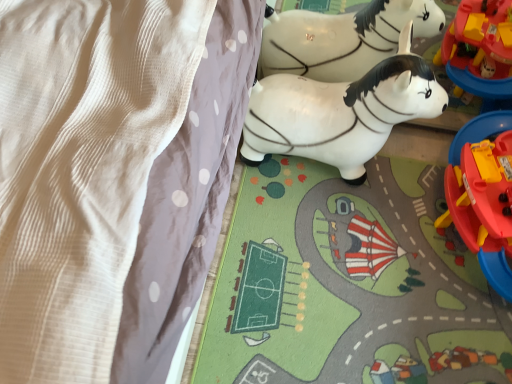
Question: Can you confirm if white glossy plastic horse at center, which is the second toy in right-to-left order, is shorter than matte plastic playset at right, which ranks as the first toy in right-to-left order?

Choices:
 (A) yes
 (B) no

Answer: (B)

Question: Can you confirm if white glossy plastic horse at center, marked as the 1th toy in a left-to-right arrangement, is positioned to the left of matte plastic playset at right, which ranks as the first toy in right-to-left order?

Choices:
 (A) yes
 (B) no

Answer: (A)

Question: Is white glossy plastic horse at center, marked as the 1th toy in a left-to-right arrangement, oriented towards matte plastic playset at right, the second toy viewed from the left?

Choices:
 (A) no
 (B) yes

Answer: (B)

Question: Is white glossy plastic horse at center, which is the second toy in right-to-left order, behind matte plastic playset at right, which ranks as the first toy in right-to-left order?

Choices:
 (A) yes
 (B) no

Answer: (A)

Question: Is white glossy plastic horse at center, which is the second toy in right-to-left order, in front of matte plastic playset at right, which ranks as the first toy in right-to-left order?

Choices:
 (A) no
 (B) yes

Answer: (A)

Question: Is white glossy plastic horse at center, which is the second toy in right-to-left order, next to matte plastic playset at right, the second toy viewed from the left, and touching it?

Choices:
 (A) yes
 (B) no

Answer: (B)

Question: Can we say matte plastic playset at right, the second toy viewed from the left, lies outside white textured blanket at upper left?

Choices:
 (A) yes
 (B) no

Answer: (A)

Question: Does matte plastic playset at right, which ranks as the first toy in right-to-left order, lie in front of white textured blanket at upper left?

Choices:
 (A) no
 (B) yes

Answer: (A)

Question: Is matte plastic playset at right, which ranks as the first toy in right-to-left order, further to the viewer compared to white textured blanket at upper left?

Choices:
 (A) yes
 (B) no

Answer: (A)

Question: Does matte plastic playset at right, the second toy viewed from the left, have a smaller size compared to white textured blanket at upper left?

Choices:
 (A) yes
 (B) no

Answer: (A)

Question: Is matte plastic playset at right, which ranks as the first toy in right-to-left order, to the right of white textured blanket at upper left from the viewer's perspective?

Choices:
 (A) yes
 (B) no

Answer: (A)

Question: Can you confirm if matte plastic playset at right, the second toy viewed from the left, is shorter than white textured blanket at upper left?

Choices:
 (A) no
 (B) yes

Answer: (B)

Question: Is the position of matte plastic playset at right, which ranks as the first toy in right-to-left order, more distant than that of white glossy plastic horse at center, which is the second toy in right-to-left order?

Choices:
 (A) yes
 (B) no

Answer: (B)